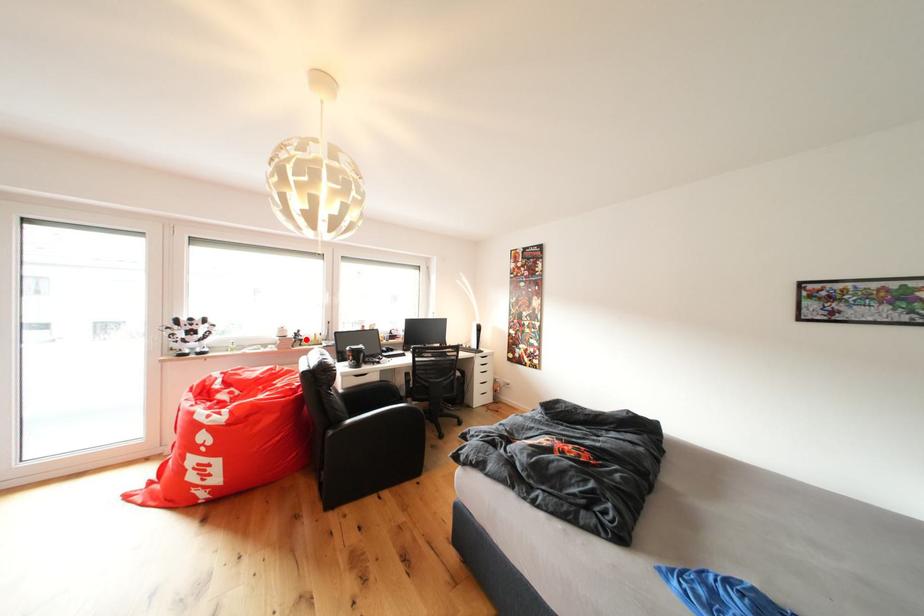
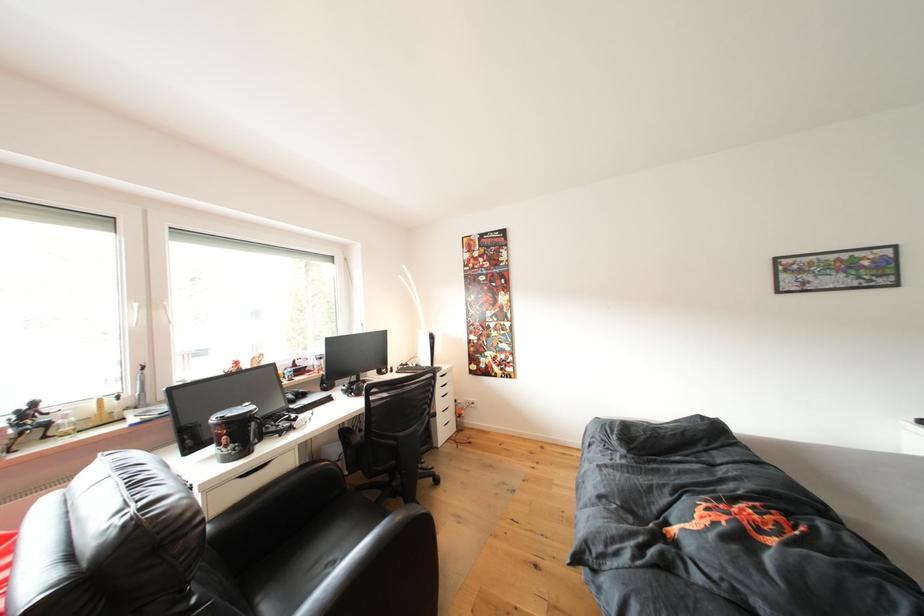
Question: A red point is marked in image1. In image2, is the corresponding 3D point closer to the camera or farther? Reply with the corresponding letter.

Choices:
 (A) The corresponding 3D point is closer.
 (B) The corresponding 3D point is farther.

Answer: (A)